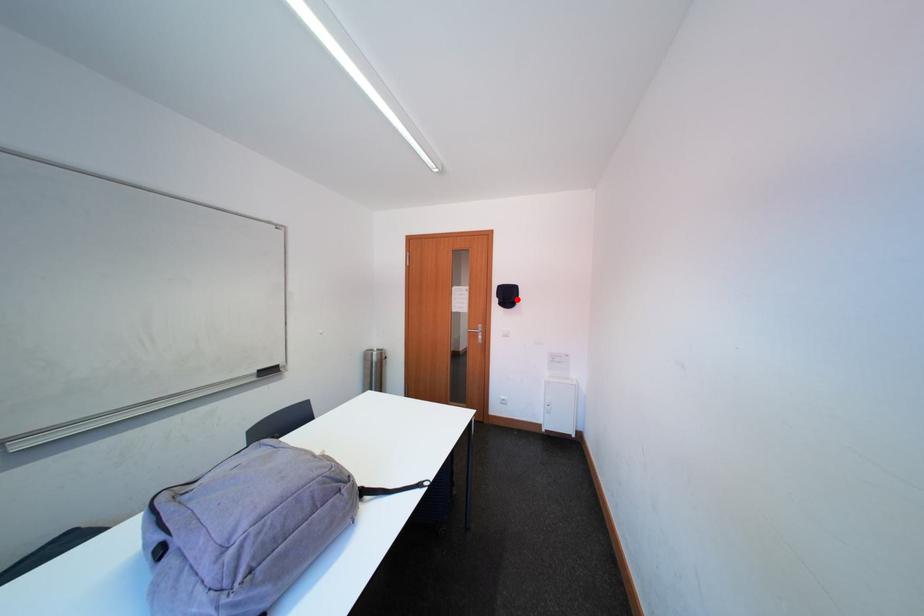
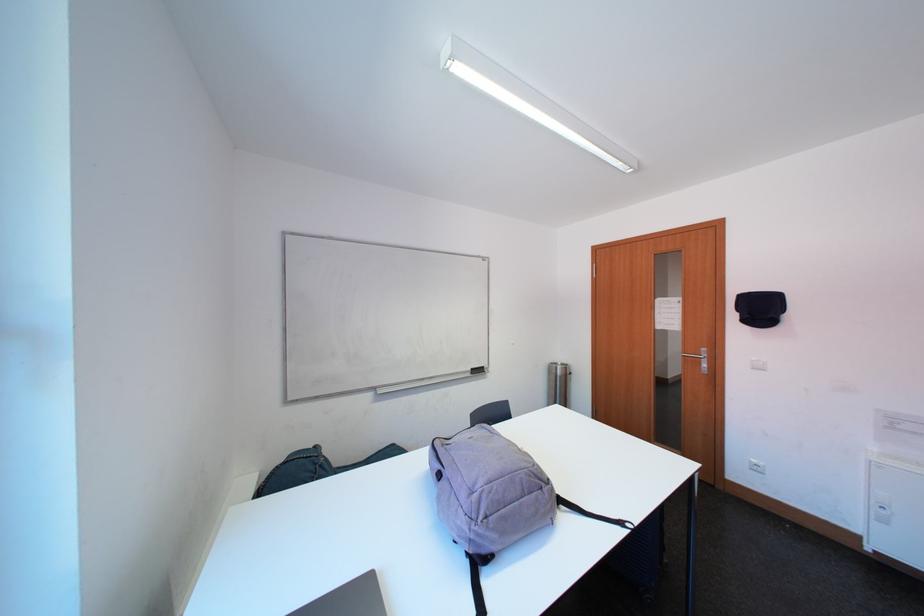
Where in the second image is the point corresponding to the highlighted location from the first image?

(771, 313)